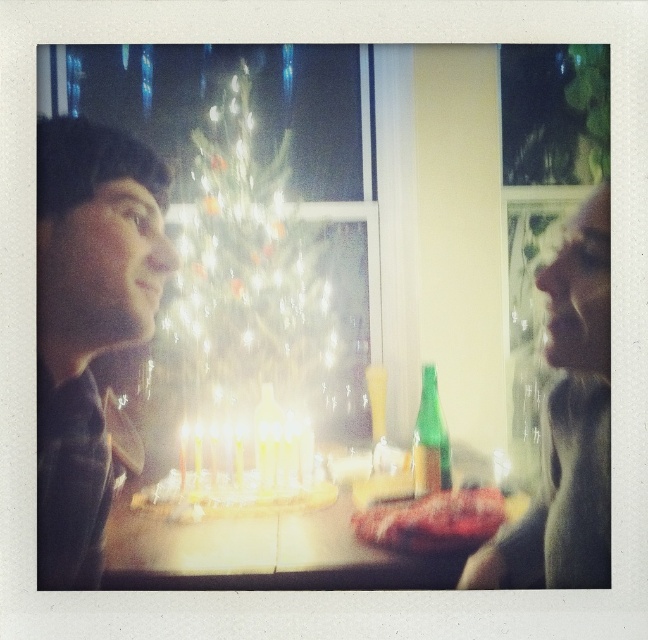
How far apart are illuminated glass christmas tree at center and white glossy table at center?

The distance of illuminated glass christmas tree at center from white glossy table at center is 14.98 inches.

Between point (257, 74) and point (316, 513), which one is positioned behind?

The point (316, 513) is behind.

Identify the location of illuminated glass christmas tree at center. This screenshot has height=640, width=648. (264, 236).

Between matte black shirt at left and white glossy table at center, which one has more height?

matte black shirt at left

Can you confirm if matte black shirt at left is shorter than white glossy table at center?

Incorrect, matte black shirt at left's height does not fall short of white glossy table at center's.

The image size is (648, 640). What are the coordinates of `matte black shirt at left` in the screenshot? It's located at (87, 323).

Image resolution: width=648 pixels, height=640 pixels. In order to click on matte black shirt at left in this screenshot , I will do `click(87, 323)`.

Is illuminated glass christmas tree at center taller than smooth skin face at right?

Indeed, illuminated glass christmas tree at center has a greater height compared to smooth skin face at right.

Does illuminated glass christmas tree at center have a lesser width compared to smooth skin face at right?

No, illuminated glass christmas tree at center is not thinner than smooth skin face at right.

I want to click on illuminated glass christmas tree at center, so click(x=264, y=236).